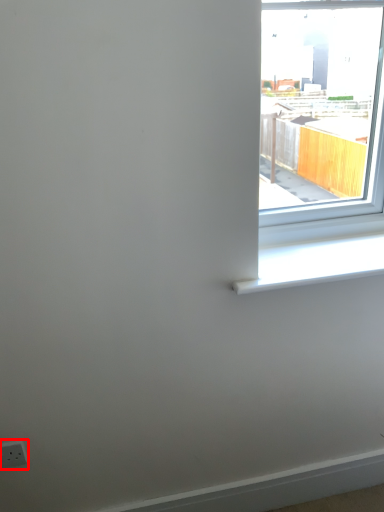
Question: From the image, what is the correct spatial relationship of electric outlet (annotated by the red box) in relation to window sill?

Choices:
 (A) left
 (B) right

Answer: (A)